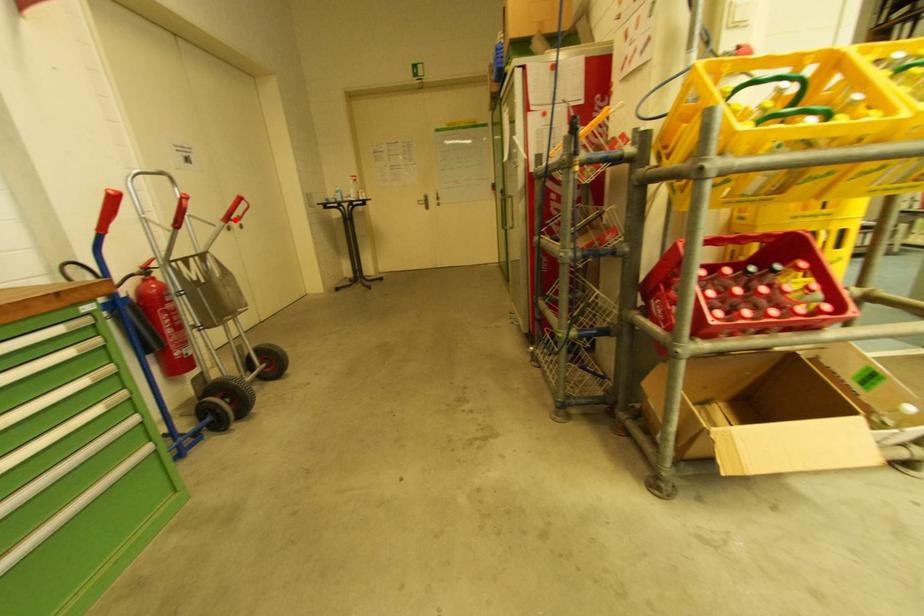
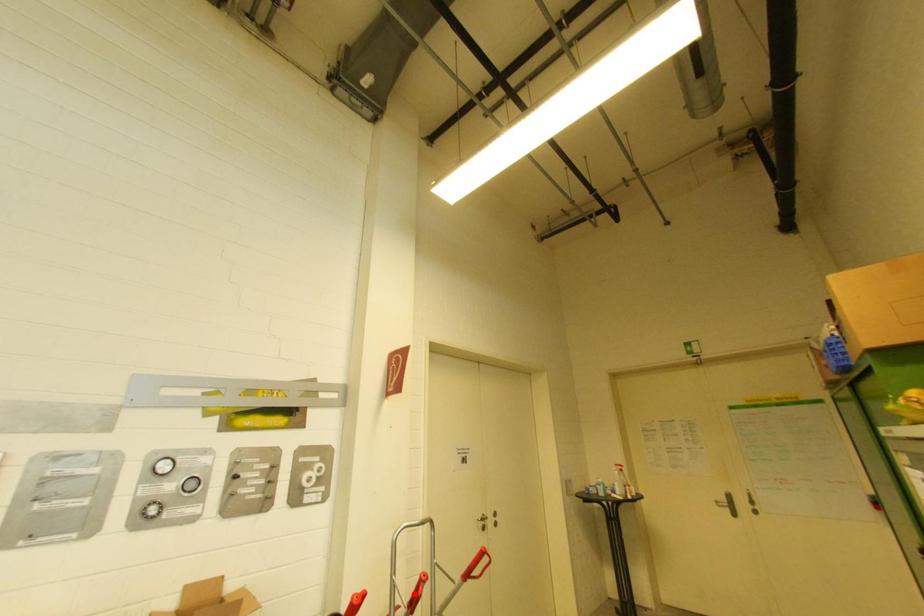
I am providing you with two images of the same scene from different viewpoints. A red point is marked on the first image and another point is marked on the second image. Does the point marked in image1 correspond to the same location as the one in image2?

No